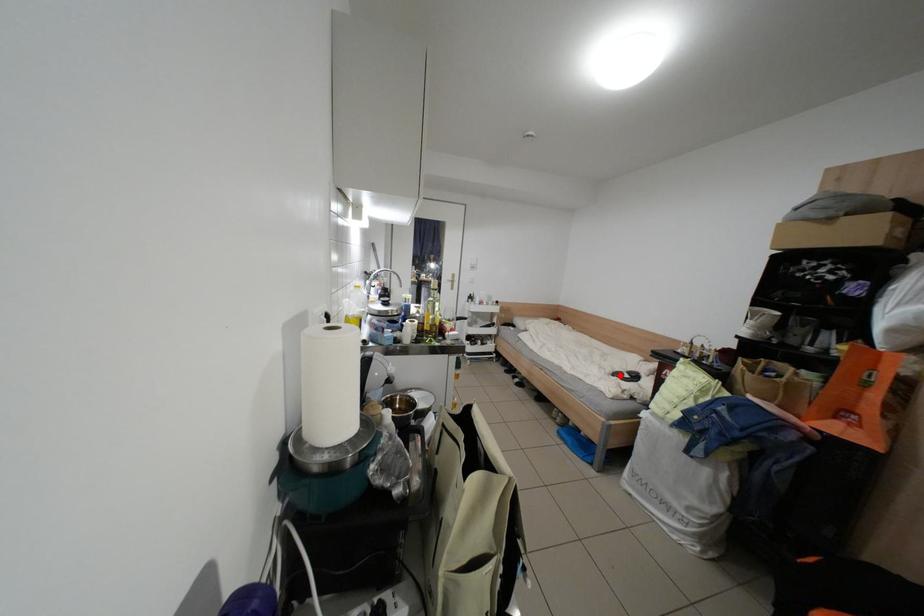
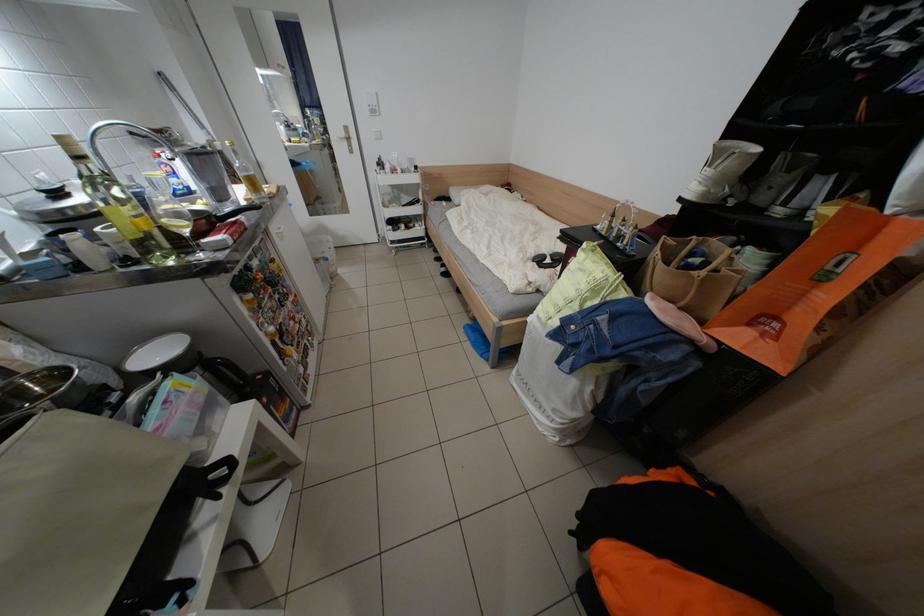
The point at the highlighted location is marked in the first image. Where is the corresponding point in the second image?

(540, 261)